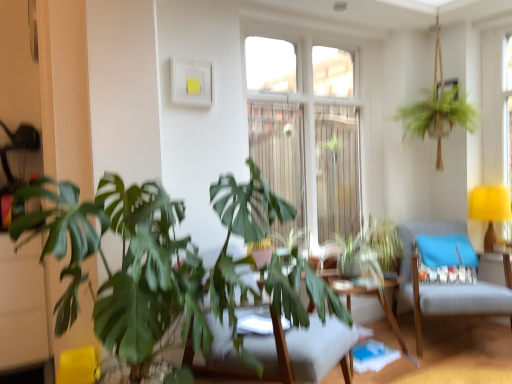
Find the location of a particular element. This screenshot has height=384, width=512. yellow fabric lampshade at right is located at coordinates (490, 209).

Measure the distance between wooden swivel chair at center, which appears as the 1th swivel chair when viewed from the front, and camera.

The distance of wooden swivel chair at center, which appears as the 1th swivel chair when viewed from the front, from camera is 5.26 feet.

Describe the element at coordinates (450, 282) in the screenshot. This screenshot has width=512, height=384. I see `light blue fabric swivel chair at center right, the 1th swivel chair when ordered from right to left` at that location.

Describe the element at coordinates (333, 129) in the screenshot. I see `clear glass window at center` at that location.

In order to face clear glass window at center, should I rotate leftwards or rightwards?

To face it directly, rotate right by 8.087 degrees.

This screenshot has width=512, height=384. Identify the location of green leafy plant at center. (150, 259).

You are a GUI agent. You are given a task and a screenshot of the screen. Output one action in this format:
    pyautogui.click(x=<x>, y=<y>)
    Task: Click on the yellow fabric lampshade at right
    The image size is (512, 384).
    Given the screenshot: What is the action you would take?
    pyautogui.click(x=490, y=209)

From a real-world perspective, does wooden swivel chair at center, acting as the 1th swivel chair starting from the left, stand above light blue fabric swivel chair at center right, placed as the 2th swivel chair when sorted from left to right?

Correct, in the physical world, wooden swivel chair at center, acting as the 1th swivel chair starting from the left, is higher than light blue fabric swivel chair at center right, placed as the 2th swivel chair when sorted from left to right.

Is wooden swivel chair at center, which is the second swivel chair in back-to-front order, far away from light blue fabric swivel chair at center right, the 1th swivel chair positioned from the back?

Absolutely, wooden swivel chair at center, which is the second swivel chair in back-to-front order, is distant from light blue fabric swivel chair at center right, the 1th swivel chair positioned from the back.

From the image's perspective, which is above, wooden swivel chair at center, which is the second swivel chair in back-to-front order, or light blue fabric swivel chair at center right, placed as the 2th swivel chair when sorted from left to right?

light blue fabric swivel chair at center right, placed as the 2th swivel chair when sorted from left to right, appears higher in the image.

From the image's perspective, is green leafy plant at center below light blue fabric swivel chair at center right, the 1th swivel chair when ordered from right to left?

Actually, green leafy plant at center appears above light blue fabric swivel chair at center right, the 1th swivel chair when ordered from right to left, in the image.

Consider the image. Measure the distance between green leafy plant at center and light blue fabric swivel chair at center right, the 1th swivel chair positioned from the back.

green leafy plant at center and light blue fabric swivel chair at center right, the 1th swivel chair positioned from the back, are 1.52 meters apart.

Considering the relative positions of green leafy plant at center and light blue fabric swivel chair at center right, the 1th swivel chair positioned from the back, in the image provided, is green leafy plant at center to the left of light blue fabric swivel chair at center right, the 1th swivel chair positioned from the back, from the viewer's perspective?

Correct, you'll find green leafy plant at center to the left of light blue fabric swivel chair at center right, the 1th swivel chair positioned from the back.

Between green leafy plant at center and light blue fabric swivel chair at center right, the 1th swivel chair positioned from the back, which one has larger width?

green leafy plant at center.

Is clear glass window at center further to camera compared to light blue fabric swivel chair at center right, the 1th swivel chair when ordered from right to left?

Yes, clear glass window at center is further from the camera.

How distant is clear glass window at center from light blue fabric swivel chair at center right, the 1th swivel chair when ordered from right to left?

clear glass window at center is 37.68 inches away from light blue fabric swivel chair at center right, the 1th swivel chair when ordered from right to left.

Between clear glass window at center and light blue fabric swivel chair at center right, which ranks as the second swivel chair in front-to-back order, which one has smaller width?

Thinner between the two is clear glass window at center.

From a real-world perspective, which is physically above, clear glass window at center or light blue fabric swivel chair at center right, the 1th swivel chair positioned from the back?

clear glass window at center is physically above.

Is blue fabric pillow at right completely or partially outside of light blue fabric swivel chair at center right, the 1th swivel chair when ordered from right to left?

No, blue fabric pillow at right is inside light blue fabric swivel chair at center right, the 1th swivel chair when ordered from right to left,'s boundary.

Would you say blue fabric pillow at right is a long distance from light blue fabric swivel chair at center right, placed as the 2th swivel chair when sorted from left to right?

blue fabric pillow at right is actually quite close to light blue fabric swivel chair at center right, placed as the 2th swivel chair when sorted from left to right.

Which object is thinner, blue fabric pillow at right or light blue fabric swivel chair at center right, the 1th swivel chair positioned from the back?

With smaller width is blue fabric pillow at right.

How different are the orientations of blue fabric pillow at right and light blue fabric swivel chair at center right, the 1th swivel chair positioned from the back, in degrees?

There is a 6.85-degree angle between the facing directions of blue fabric pillow at right and light blue fabric swivel chair at center right, the 1th swivel chair positioned from the back.

This screenshot has height=384, width=512. I want to click on table lamp that is behind the green leafy plant at center, so click(x=490, y=209).

Considering the points (484, 248) and (268, 205), which point is behind, point (484, 248) or point (268, 205)?

The point (484, 248) is behind.

Is yellow fabric lampshade at right next to green leafy plant at center and touching it?

No, yellow fabric lampshade at right is not beside green leafy plant at center.

Considering the relative sizes of yellow fabric lampshade at right and green leafy plant at center in the image provided, is yellow fabric lampshade at right wider than green leafy plant at center?

Incorrect, the width of yellow fabric lampshade at right does not surpass that of green leafy plant at center.

Would you say green leafy plant at center is inside or outside clear glass window at center?

green leafy plant at center is outside clear glass window at center.

Is clear glass window at center at the back of green leafy plant at center?

No, clear glass window at center is not at the back of green leafy plant at center.

Considering the positions of point (80, 228) and point (314, 170), is point (80, 228) closer or farther from the camera than point (314, 170)?

Point (80, 228).

Which object is positioned more to the left, wooden table at center or blue fabric pillow at right?

wooden table at center.

Which is closer to the camera, (342,290) or (452,238)?

The point (342,290) is in front.

Who is smaller, wooden table at center or blue fabric pillow at right?

blue fabric pillow at right is smaller.

Is blue fabric pillow at right at the back of wooden table at center?

wooden table at center is not turned away from blue fabric pillow at right.

Where is `swivel chair that is under the wooden swivel chair at center, which appears as the 1th swivel chair when viewed from the front (from a real-world perspective)`? This screenshot has width=512, height=384. swivel chair that is under the wooden swivel chair at center, which appears as the 1th swivel chair when viewed from the front (from a real-world perspective) is located at coordinates pyautogui.click(x=450, y=282).

Image resolution: width=512 pixels, height=384 pixels. What are the coordinates of `houseplant on the left of light blue fabric swivel chair at center right, which ranks as the second swivel chair in front-to-back order` in the screenshot? It's located at (150, 259).

In the scene shown: From the image, which object appears to be farther from clear glass window at center, blue fabric pillow at right or wooden swivel chair at center, which is the second swivel chair in back-to-front order?

wooden swivel chair at center, which is the second swivel chair in back-to-front order, is positioned further to the anchor clear glass window at center.

Which object lies further to the anchor point clear glass window at center, green leafy plant at center or wooden swivel chair at center, which is the second swivel chair in back-to-front order?

wooden swivel chair at center, which is the second swivel chair in back-to-front order, is positioned further to the anchor clear glass window at center.

Which object lies nearer to the anchor point wooden swivel chair at center, which is the second swivel chair in back-to-front order, blue fabric pillow at right or light blue fabric swivel chair at center right, the 1th swivel chair positioned from the back?

light blue fabric swivel chair at center right, the 1th swivel chair positioned from the back, is positioned closer to the anchor wooden swivel chair at center, which is the second swivel chair in back-to-front order.

Which object lies further to the anchor point wooden swivel chair at center, which appears as the 1th swivel chair when viewed from the front, clear glass window at center or blue fabric pillow at right?

clear glass window at center.

From the image, which object appears to be nearer to clear glass window at center, blue fabric pillow at right or green leafy plant at center?

blue fabric pillow at right is closer to clear glass window at center.

Based on their spatial positions, is blue fabric pillow at right or yellow fabric lampshade at right further from green leafy plant at center?

yellow fabric lampshade at right.

Looking at the image, which one is located closer to green leafy plant at center, light blue fabric swivel chair at center right, the 1th swivel chair positioned from the back, or blue fabric pillow at right?

Among the two, light blue fabric swivel chair at center right, the 1th swivel chair positioned from the back, is located nearer to green leafy plant at center.

From the image, which object appears to be farther from clear glass window at center, wooden swivel chair at center, which appears as the 1th swivel chair when viewed from the front, or yellow fabric lampshade at right?

The object further to clear glass window at center is wooden swivel chair at center, which appears as the 1th swivel chair when viewed from the front.

What are the coordinates of `table situated between wooden swivel chair at center, which appears as the 1th swivel chair when viewed from the front, and blue fabric pillow at right from left to right` in the screenshot? It's located at (368, 295).

The height and width of the screenshot is (384, 512). Identify the location of pillow between wooden swivel chair at center, which appears as the 1th swivel chair when viewed from the front, and yellow fabric lampshade at right, in the horizontal direction. (446, 250).

Find the location of a particular element. The width and height of the screenshot is (512, 384). pillow between clear glass window at center and light blue fabric swivel chair at center right, which ranks as the second swivel chair in front-to-back order, from top to bottom is located at coordinates (446, 250).

Where is `window situated between wooden swivel chair at center, acting as the 1th swivel chair starting from the left, and light blue fabric swivel chair at center right, which ranks as the second swivel chair in front-to-back order, from left to right`? This screenshot has width=512, height=384. window situated between wooden swivel chair at center, acting as the 1th swivel chair starting from the left, and light blue fabric swivel chair at center right, which ranks as the second swivel chair in front-to-back order, from left to right is located at coordinates (333, 129).